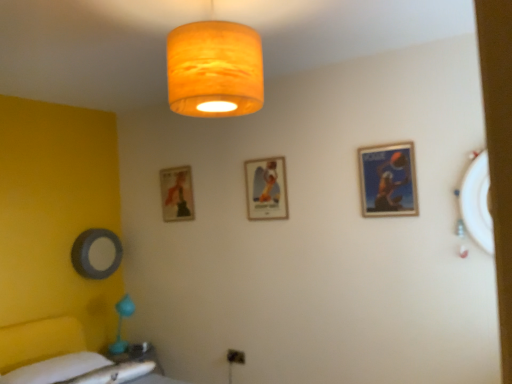
Question: Based on their sizes in the image, would you say matte gold picture frame at center, acting as the 2th picture frame starting from the front, is bigger or smaller than matte blue poster at upper right, the first picture frame in the front-to-back sequence?

Choices:
 (A) big
 (B) small

Answer: (A)

Question: Would you say matte gold picture frame at center, placed as the second picture frame when sorted from left to right, is to the left or to the right of matte blue poster at upper right, the first picture frame in the right-to-left sequence, in the picture?

Choices:
 (A) right
 (B) left

Answer: (B)

Question: Estimate the real-world distances between objects in this image. Which object is closer to the matte orange fabric lampshade at upper center?

Choices:
 (A) matte gold picture frame at center, the 2th picture frame in the back-to-front sequence
 (B) matte blue poster at upper right, the first picture frame in the right-to-left sequence
 (C) white fabric bedsheet at lower left
 (D) matte gold picture frame at center left, which is the 3th picture frame from right to left
 (E) matte white table at lower left

Answer: (B)

Question: Estimate the real-world distances between objects in this image. Which object is closer to the matte blue poster at upper right, acting as the third picture frame starting from the left?

Choices:
 (A) matte orange fabric lampshade at upper center
 (B) matte white table at lower left
 (C) matte gold picture frame at center, acting as the 2th picture frame starting from the front
 (D) matte gold picture frame at center left, the 3th picture frame from the front
 (E) white fabric bedsheet at lower left

Answer: (C)